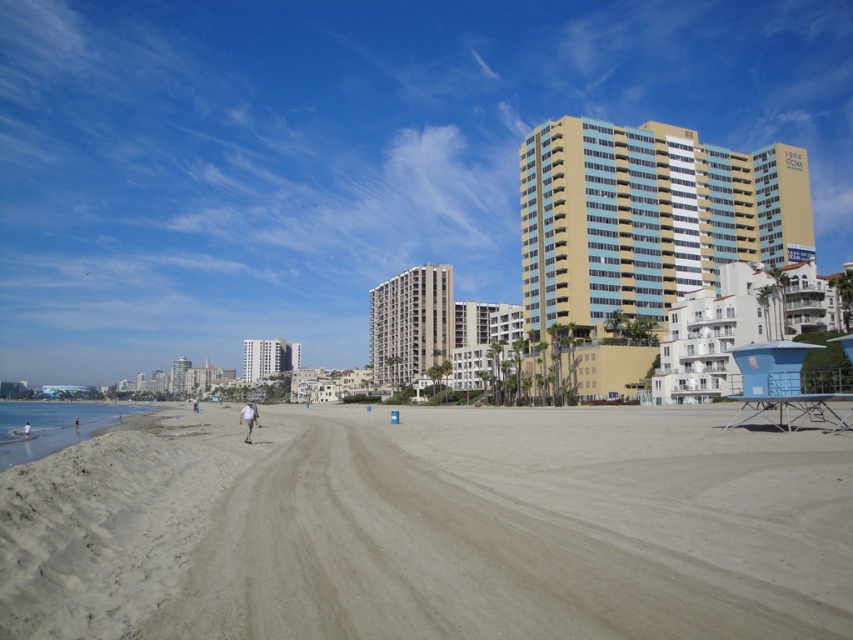
You are standing on the beach and see two points marked on the sand. The first point is at coordinates point (729, 317) and the second is at point (291, 364). Which point is closer to you?

Point (729, 317) is in front of point (291, 364), so it is closer to you.